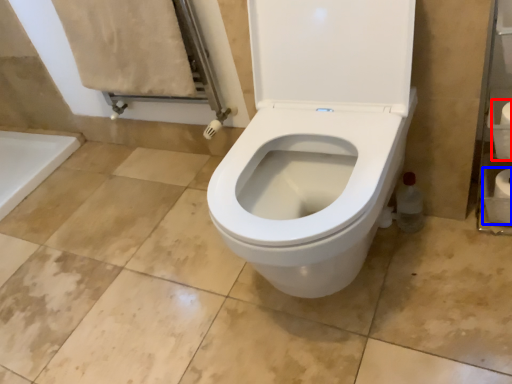
Question: Which point is closer to the camera, toilet paper (highlighted by a red box) or toilet paper (highlighted by a blue box)?

Choices:
 (A) toilet paper
 (B) toilet paper

Answer: (A)